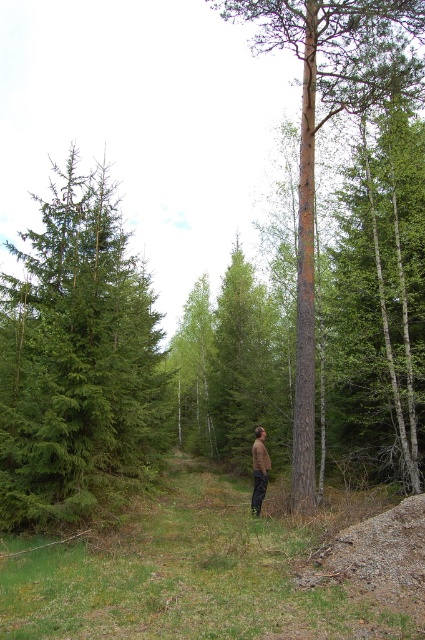
Question: Which point is farther from the camera taking this photo?

Choices:
 (A) (401, 68)
 (B) (159, 384)

Answer: (B)

Question: Can you confirm if green needle-like tree at left is smaller than brown fabric pants at center?

Choices:
 (A) yes
 (B) no

Answer: (B)

Question: Estimate the real-world distances between objects in this image. Which object is farther from the brown rough bark tree at center?

Choices:
 (A) brown fabric pants at center
 (B) green needle-like tree at left

Answer: (A)

Question: Does green needle-like tree at left have a lesser width compared to brown fabric pants at center?

Choices:
 (A) no
 (B) yes

Answer: (A)

Question: Which of the following is the farthest from the observer?

Choices:
 (A) brown rough bark tree at center
 (B) green needle-like tree at left

Answer: (A)

Question: Can you confirm if green needle-like tree at left is positioned to the right of brown fabric pants at center?

Choices:
 (A) no
 (B) yes

Answer: (A)